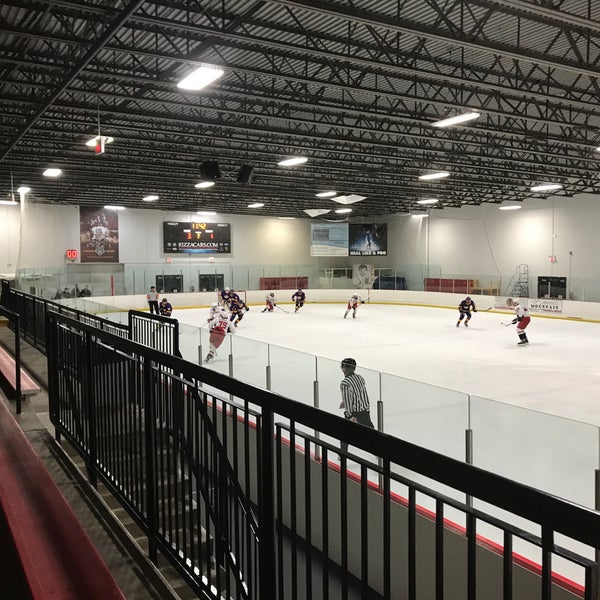
At what (x,y) coordinates should I click in order to perform the action: click on floor. Please return your answer as a coordinate pair (x, y). Looking at the image, I should click on (417, 352).